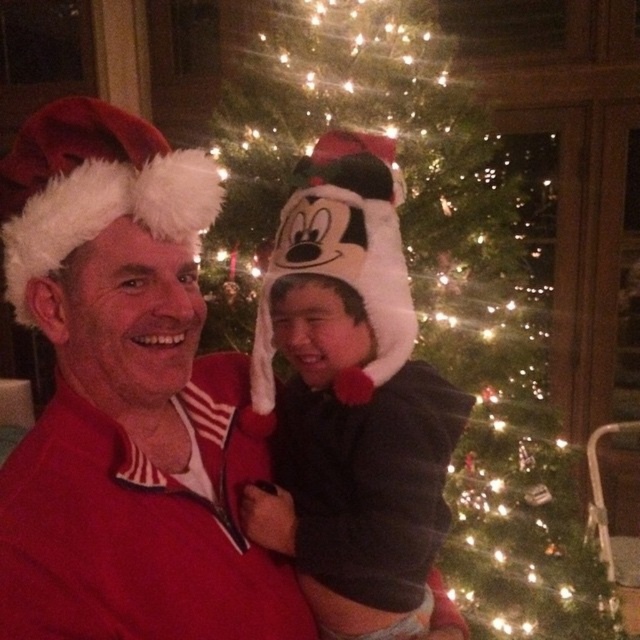
Question: Is illuminated green christmas tree at center to the right of matte red santa hat at left from the viewer's perspective?

Choices:
 (A) yes
 (B) no

Answer: (A)

Question: Which point is closer to the camera taking this photo?

Choices:
 (A) (593, 70)
 (B) (6, 506)

Answer: (B)

Question: Which point appears farthest from the camera in this image?

Choices:
 (A) (388, 576)
 (B) (458, 154)

Answer: (B)

Question: Among these points, which one is nearest to the camera?

Choices:
 (A) (348, 312)
 (B) (77, 364)

Answer: (B)

Question: Does matte red santa hat at left have a lesser width compared to black fleece hoodie at center?

Choices:
 (A) no
 (B) yes

Answer: (A)

Question: Is illuminated green christmas tree at center below black fleece hoodie at center?

Choices:
 (A) no
 (B) yes

Answer: (A)